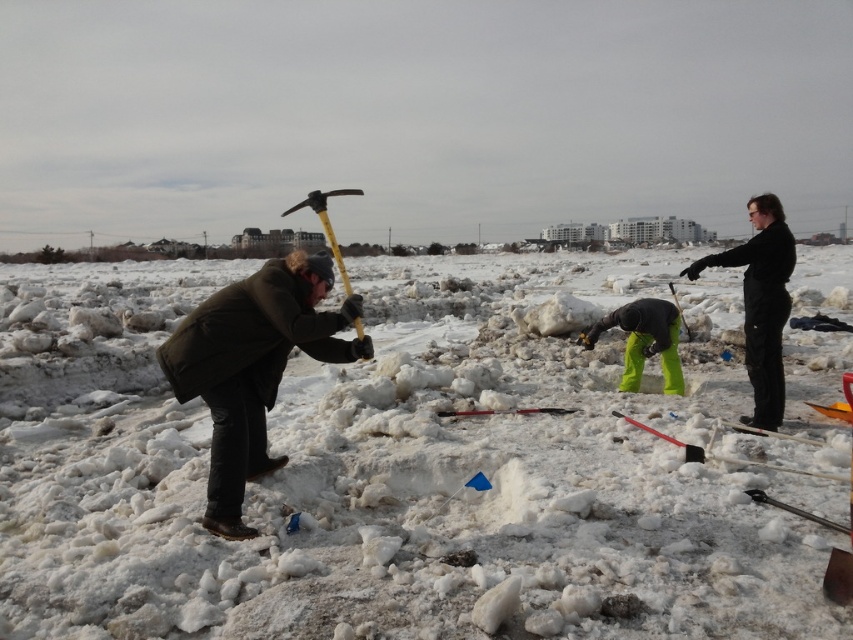
Who is more distant from viewer, (636, 358) or (527, 412)?

Positioned behind is point (636, 358).

Where is `green fabric pants at center`? This screenshot has height=640, width=853. green fabric pants at center is located at coordinates (643, 340).

The image size is (853, 640). What do you see at coordinates (396, 468) in the screenshot?
I see `white fluffy snow at center` at bounding box center [396, 468].

Is white fluffy snow at center positioned at the back of smooth plastic shovel at center?

No.

Image resolution: width=853 pixels, height=640 pixels. What do you see at coordinates (396, 468) in the screenshot?
I see `white fluffy snow at center` at bounding box center [396, 468].

The height and width of the screenshot is (640, 853). Find the location of `white fluffy snow at center`. white fluffy snow at center is located at coordinates (396, 468).

Looking at this image, does white fluffy snow at center have a greater height compared to green fabric pants at center?

Yes, white fluffy snow at center is taller than green fabric pants at center.

Which is more to the right, white fluffy snow at center or green fabric pants at center?

Positioned to the right is green fabric pants at center.

Locate an element on the screen. This screenshot has height=640, width=853. white fluffy snow at center is located at coordinates (396, 468).

Find the location of a particular element. The width and height of the screenshot is (853, 640). white fluffy snow at center is located at coordinates [x=396, y=468].